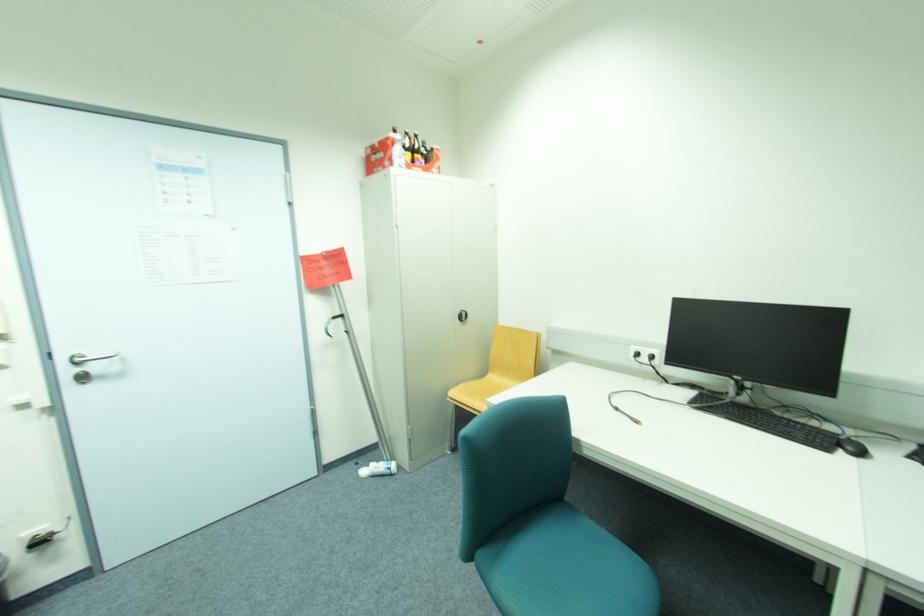
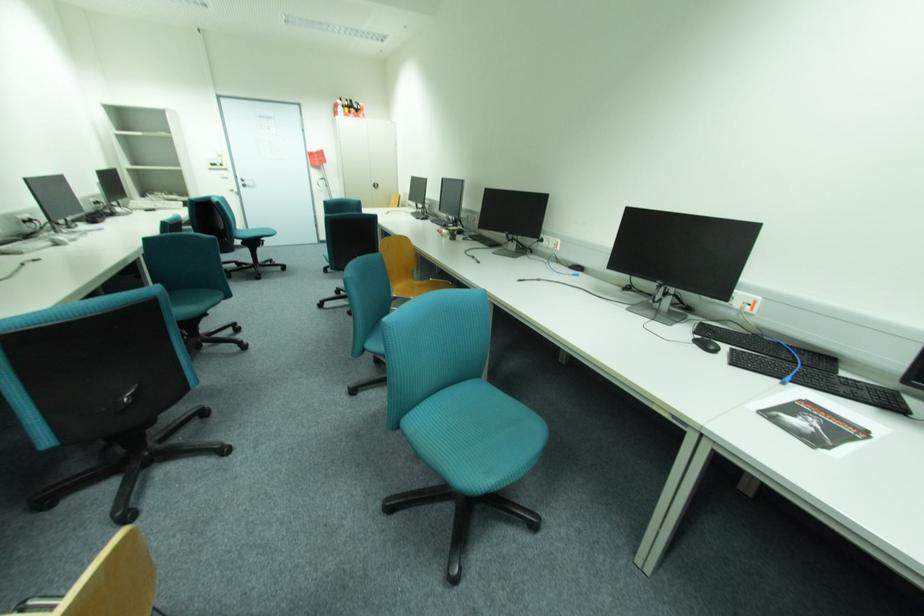
Locate, in the second image, the point that corresponds to (100,367) in the first image.

(253, 183)